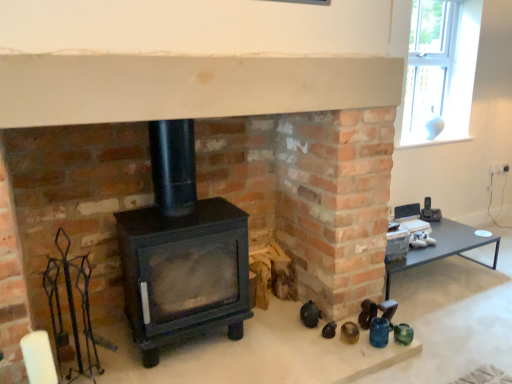
Question: Is black matte wood burning stove at center shorter than matte black table at right?

Choices:
 (A) no
 (B) yes

Answer: (A)

Question: Is black matte wood burning stove at center touching matte black table at right?

Choices:
 (A) no
 (B) yes

Answer: (A)

Question: Would you say matte black table at right is part of black matte wood burning stove at center's contents?

Choices:
 (A) no
 (B) yes

Answer: (A)

Question: Considering the relative sizes of black matte wood burning stove at center and matte black table at right in the image provided, is black matte wood burning stove at center wider than matte black table at right?

Choices:
 (A) no
 (B) yes

Answer: (A)

Question: Considering the relative sizes of black matte wood burning stove at center and matte black table at right in the image provided, is black matte wood burning stove at center smaller than matte black table at right?

Choices:
 (A) yes
 (B) no

Answer: (B)

Question: From the image's perspective, is matte black table at right located above or below white glass vase at upper right?

Choices:
 (A) below
 (B) above

Answer: (A)

Question: Considering the positions of matte black table at right and white glass vase at upper right in the image, is matte black table at right wider or thinner than white glass vase at upper right?

Choices:
 (A) wide
 (B) thin

Answer: (A)

Question: Is point (409, 256) closer or farther from the camera than point (419, 44)?

Choices:
 (A) farther
 (B) closer

Answer: (B)

Question: From a real-world perspective, relative to white glass vase at upper right, is matte black table at right vertically above or below?

Choices:
 (A) above
 (B) below

Answer: (B)

Question: Which is correct: white glass vase at upper right is inside matte black table at right, or outside of it?

Choices:
 (A) inside
 (B) outside

Answer: (B)

Question: From a real-world perspective, is white glass vase at upper right physically located above or below matte black table at right?

Choices:
 (A) above
 (B) below

Answer: (A)

Question: Looking at their shapes, would you say white glass vase at upper right is wider or thinner than matte black table at right?

Choices:
 (A) thin
 (B) wide

Answer: (A)

Question: From their relative heights in the image, would you say white glass vase at upper right is taller or shorter than matte black table at right?

Choices:
 (A) short
 (B) tall

Answer: (B)

Question: In terms of size, does white glass vase at upper right appear bigger or smaller than black matte wood burning stove at center?

Choices:
 (A) small
 (B) big

Answer: (A)

Question: From the image's perspective, is white glass vase at upper right positioned above or below black matte wood burning stove at center?

Choices:
 (A) above
 (B) below

Answer: (A)